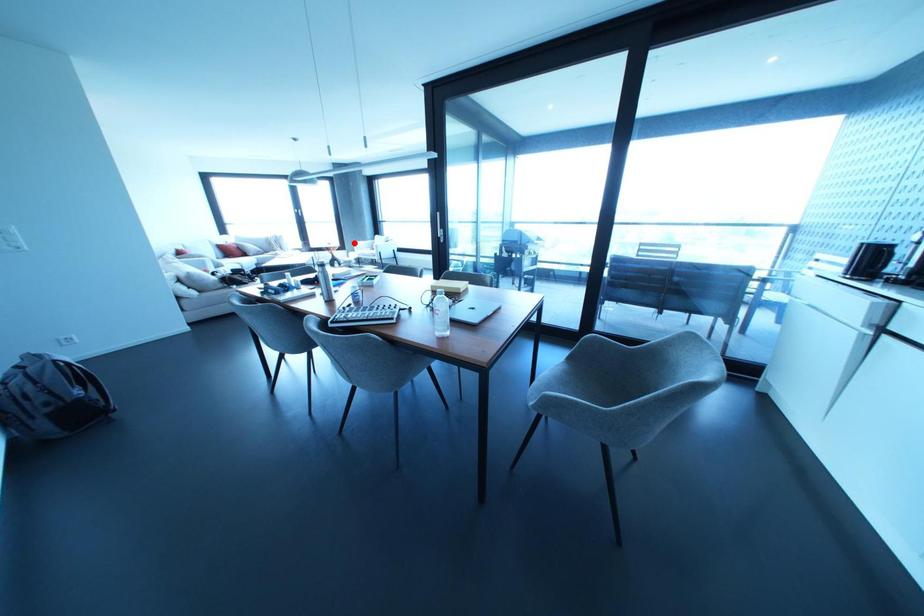
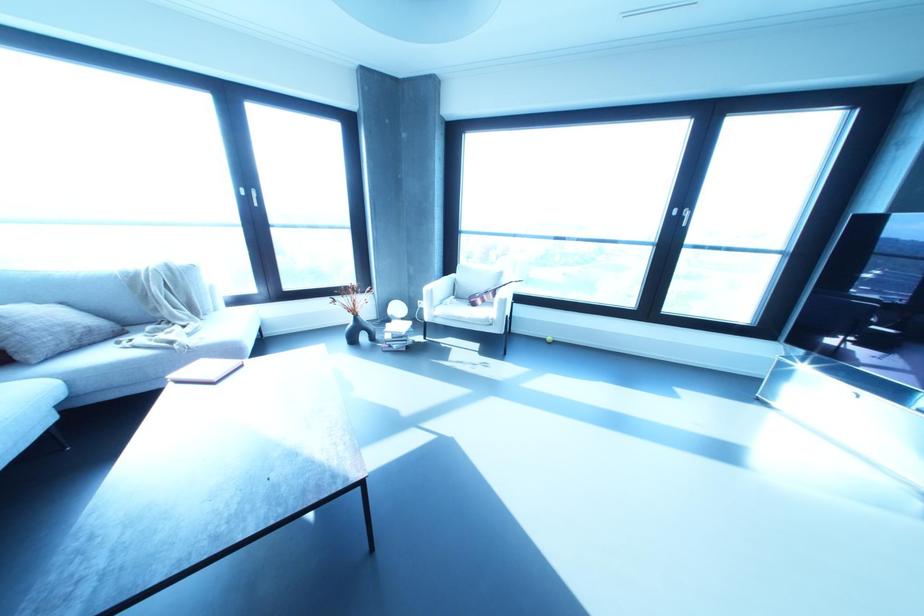
The point at the highlighted location is marked in the first image. Where is the corresponding point in the second image?

(426, 288)